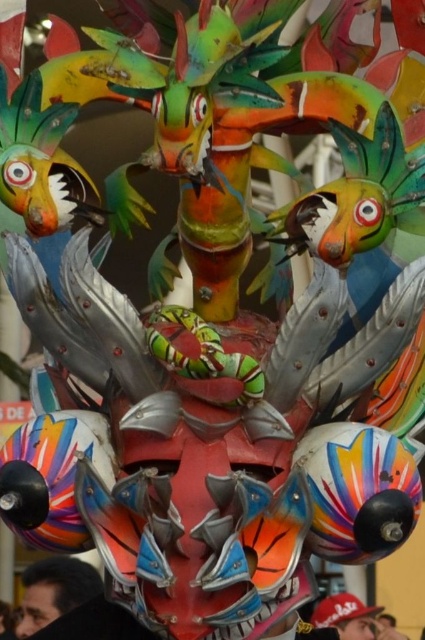
How distant is matte red baseball cap at lower center from metallic red mask at center?

5.06 meters

Does matte red baseball cap at lower center appear under metallic red mask at center?

Incorrect, matte red baseball cap at lower center is not positioned below metallic red mask at center.

Is point (337, 609) positioned in front of point (5, 605)?

Yes, it is in front of point (5, 605).

The width and height of the screenshot is (425, 640). In order to click on matte red baseball cap at lower center in this screenshot , I will do `click(346, 616)`.

Can you confirm if matte black head at lower left is shorter than matte red baseball cap at lower center?

Incorrect, matte black head at lower left's height does not fall short of matte red baseball cap at lower center's.

Where is `matte black head at lower left`? Image resolution: width=425 pixels, height=640 pixels. matte black head at lower left is located at coordinates (54, 589).

Identify the location of matte black head at lower left. (54, 589).

Which is above, matte black head at lower left or metallic red mask at center?

matte black head at lower left is higher up.

Where is `matte black head at lower left`? This screenshot has width=425, height=640. matte black head at lower left is located at coordinates (54, 589).

This screenshot has width=425, height=640. Find the location of `matte black head at lower left`. matte black head at lower left is located at coordinates click(x=54, y=589).